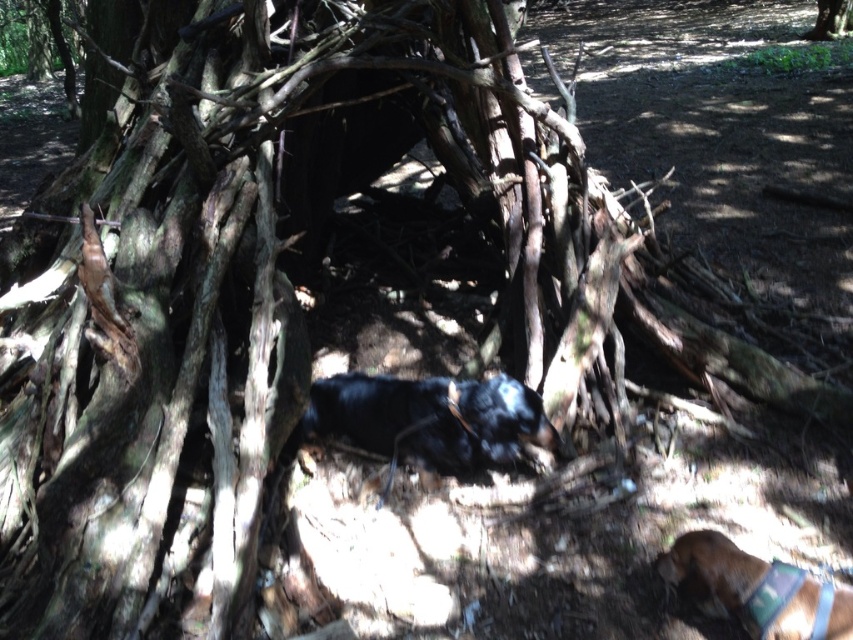
Question: Which point is farther to the camera?

Choices:
 (A) (689, 547)
 (B) (412, 428)

Answer: (B)

Question: Can you confirm if black fur dog at center is thinner than brown fabric dog at lower right?

Choices:
 (A) no
 (B) yes

Answer: (A)

Question: Which of the following is the closest to the observer?

Choices:
 (A) black fur dog at center
 (B) brown fabric dog at lower right

Answer: (B)

Question: Does black fur dog at center have a smaller size compared to brown fabric dog at lower right?

Choices:
 (A) yes
 (B) no

Answer: (B)

Question: Is black fur dog at center closer to camera compared to brown fabric dog at lower right?

Choices:
 (A) no
 (B) yes

Answer: (A)

Question: Which point is farther to the camera?

Choices:
 (A) black fur dog at center
 (B) brown fabric dog at lower right

Answer: (A)